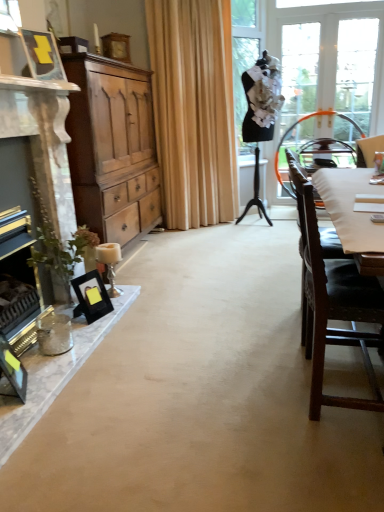
The image size is (384, 512). Identify the location of matte black picture frame at lower left, the first picture frame viewed from the front. (13, 369).

The height and width of the screenshot is (512, 384). Describe the element at coordinates (112, 147) in the screenshot. I see `matte brown cabinet at left` at that location.

Describe the element at coordinates (116, 47) in the screenshot. This screenshot has height=512, width=384. I see `wooden clock at upper center, acting as the fourth picture frame starting from the bottom` at that location.

What do you see at coordinates (350, 207) in the screenshot?
I see `white cloth-covered table at right` at bounding box center [350, 207].

Find the location of `black matte picture frame at lower left, which appears as the third picture frame when viewed from the front`. black matte picture frame at lower left, which appears as the third picture frame when viewed from the front is located at coordinates (88, 298).

I want to click on matte black picture frame at lower left, the first picture frame viewed from the front, so click(13, 369).

Can you confirm if metallic silver fireplace at left is wider than clear glass window at upper right?

Yes, metallic silver fireplace at left is wider than clear glass window at upper right.

Is metallic silver fireplace at left far from clear glass window at upper right?

Yes, metallic silver fireplace at left and clear glass window at upper right are quite far apart.

Who is taller, metallic silver fireplace at left or clear glass window at upper right?

Standing taller between the two is clear glass window at upper right.

From a real-world perspective, is metallic silver fireplace at left over clear glass window at upper right?

Actually, metallic silver fireplace at left is physically below clear glass window at upper right in the real world.

Is matte black picture frame at lower left, positioned as the fourth picture frame in top-to-bottom order, taller or shorter than dark brown wood chair at right, the second chair when ordered from right to left?

In the image, matte black picture frame at lower left, positioned as the fourth picture frame in top-to-bottom order, appears to be shorter than dark brown wood chair at right, the second chair when ordered from right to left.

Is the position of matte black picture frame at lower left, the 1th picture frame ordered from the bottom, more distant than that of dark brown wood chair at right, arranged as the 2th chair when viewed from the top?

Yes, matte black picture frame at lower left, the 1th picture frame ordered from the bottom, is further from the viewer.

Image resolution: width=384 pixels, height=512 pixels. I want to click on chair that is the 1st object located above the matte black picture frame at lower left, the 1th picture frame ordered from the bottom (from the image's perspective), so click(x=332, y=298).

Is matte black picture frame at lower left, positioned as the fourth picture frame in top-to-bottom order, aimed at dark brown wood chair at right, the 1th chair when ordered from front to back?

Yes.

Find the location of a particular element. This screenshot has height=512, width=384. chair that is under the white cloth-covered table at right (from a real-world perspective) is located at coordinates (332, 298).

Which is behind, point (369, 319) or point (376, 230)?

The point (369, 319) is behind.

Looking at this image, from a real-world perspective, which object stands above the other?

white cloth-covered table at right, from a real-world perspective.

Is dark brown wood chair at right, marked as the 1th chair in a left-to-right arrangement, wider than white cloth-covered table at right?

No.

Is black matte picture frame at lower left, marked as the 3th picture frame in a top-to-bottom arrangement, positioned with its back to matte black picture frame at upper left, the second picture frame positioned from the top?

No.

The image size is (384, 512). I want to click on the 3rd picture frame to the left when counting from the black matte picture frame at lower left, which appears as the third picture frame when viewed from the front, so click(x=42, y=55).

Does black matte picture frame at lower left, which appears as the third picture frame when viewed from the front, have a larger size compared to matte black picture frame at upper left, which appears as the second picture frame when viewed from the front?

Yes.

Considering the relative sizes of black matte picture frame at lower left, marked as the 3th picture frame in a top-to-bottom arrangement, and matte black picture frame at upper left, arranged as the 3th picture frame when ordered from the bottom, in the image provided, is black matte picture frame at lower left, marked as the 3th picture frame in a top-to-bottom arrangement, shorter than matte black picture frame at upper left, arranged as the 3th picture frame when ordered from the bottom,?

Yes, black matte picture frame at lower left, marked as the 3th picture frame in a top-to-bottom arrangement, is shorter than matte black picture frame at upper left, arranged as the 3th picture frame when ordered from the bottom.

In the image, is metallic silver fireplace at left positioned in front of or behind matte black picture frame at lower left, the 1th picture frame ordered from the bottom?

metallic silver fireplace at left is positioned farther from the viewer than matte black picture frame at lower left, the 1th picture frame ordered from the bottom.

Which is more distant, (23, 334) or (18, 359)?

The point (23, 334) is farther.

Image resolution: width=384 pixels, height=512 pixels. What are the coordinates of `picture frame in front of the metallic silver fireplace at left` in the screenshot? It's located at (13, 369).

Considering the sizes of metallic silver fireplace at left and matte black picture frame at lower left, which ranks as the 4th picture frame in back-to-front order, in the image, is metallic silver fireplace at left taller or shorter than matte black picture frame at lower left, which ranks as the 4th picture frame in back-to-front order,?

metallic silver fireplace at left is taller than matte black picture frame at lower left, which ranks as the 4th picture frame in back-to-front order.

From the image's perspective, is dark brown wood chair at right, which appears as the 1th chair when ordered from the bottom, under wooden clock at upper center, which is the 1th picture frame from back to front?

Yes, from the image's perspective, dark brown wood chair at right, which appears as the 1th chair when ordered from the bottom, is below wooden clock at upper center, which is the 1th picture frame from back to front.

Between dark brown wood chair at right, which appears as the 1th chair when ordered from the bottom, and wooden clock at upper center, acting as the fourth picture frame starting from the bottom, which one has smaller size?

Smaller between the two is wooden clock at upper center, acting as the fourth picture frame starting from the bottom.

Where is `the 2nd picture frame located above the dark brown wood chair at right, arranged as the 2th chair when viewed from the top (from a real-world perspective)`? Image resolution: width=384 pixels, height=512 pixels. the 2nd picture frame located above the dark brown wood chair at right, arranged as the 2th chair when viewed from the top (from a real-world perspective) is located at coordinates (116, 47).

Does dark brown wood chair at right, arranged as the 2th chair when viewed from the top, turn towards wooden clock at upper center, which is the 1th picture frame from back to front?

No, dark brown wood chair at right, arranged as the 2th chair when viewed from the top, is not oriented towards wooden clock at upper center, which is the 1th picture frame from back to front.

Would you consider beige fabric curtain at center to be distant from black matte picture frame at lower left, which appears as the third picture frame when viewed from the front?

beige fabric curtain at center is positioned a significant distance from black matte picture frame at lower left, which appears as the third picture frame when viewed from the front.

From a real-world perspective, which object rests below the other?

black matte picture frame at lower left, marked as the 2th picture frame in a bottom-to-top arrangement, is physically lower.

From the picture: Which of these two, beige fabric curtain at center or black matte picture frame at lower left, marked as the 2th picture frame in a bottom-to-top arrangement, stands taller?

beige fabric curtain at center is taller.

Locate an element on the screen. This screenshot has width=384, height=512. fireplace that appears below the clear glass window at upper right (from a real-world perspective) is located at coordinates (20, 279).

Locate an element on the screen. This screenshot has height=512, width=384. the 1st chair to the right when counting from the matte black picture frame at lower left, positioned as the fourth picture frame in top-to-bottom order is located at coordinates (332, 298).

Considering their positions, is beige fabric curtain at center positioned closer to dark brown wood chair at right, marked as the 1th chair in a left-to-right arrangement, than white cloth-covered table at right?

Among the two, white cloth-covered table at right is located nearer to dark brown wood chair at right, marked as the 1th chair in a left-to-right arrangement.

Which object lies nearer to the anchor point matte black picture frame at lower left, the first picture frame viewed from the front, matte brown cabinet at left or dark brown wood chair at right, the 1th chair when ordered from front to back?

The object closer to matte black picture frame at lower left, the first picture frame viewed from the front, is dark brown wood chair at right, the 1th chair when ordered from front to back.

From the image, which object appears to be nearer to beige fabric curtain at center, wooden chair at right, acting as the second chair starting from the front, or matte brown cabinet at left?

matte brown cabinet at left is closer to beige fabric curtain at center.

Which object lies further to the anchor point wooden clock at upper center, acting as the fourth picture frame starting from the bottom, white cloth-covered table at right or clear glass window at upper right?

Based on the image, white cloth-covered table at right appears to be further to wooden clock at upper center, acting as the fourth picture frame starting from the bottom.

Which object lies further to the anchor point white cloth-covered table at right, clear glass window at upper right or beige fabric curtain at center?

Among the two, clear glass window at upper right is located further to white cloth-covered table at right.

Which object lies further to the anchor point matte brown cabinet at left, black matte picture frame at lower left, marked as the 3th picture frame in a top-to-bottom arrangement, or matte black picture frame at lower left, the first picture frame viewed from the front?

matte black picture frame at lower left, the first picture frame viewed from the front, lies further to matte brown cabinet at left than the other object.

Which object lies further to the anchor point beige fabric curtain at center, clear glass window at upper right or matte black picture frame at lower left, which ranks as the 4th picture frame in back-to-front order?

matte black picture frame at lower left, which ranks as the 4th picture frame in back-to-front order, is positioned further to the anchor beige fabric curtain at center.

Based on the photo, based on their spatial positions, is matte black picture frame at upper left, marked as the third picture frame in a back-to-front arrangement, or clear glass window at upper right closer to metallic silver fireplace at left?

The object closer to metallic silver fireplace at left is matte black picture frame at upper left, marked as the third picture frame in a back-to-front arrangement.

What are the coordinates of `cabinetry between matte black picture frame at upper left, arranged as the 3th picture frame when ordered from the bottom, and metallic silver fireplace at left vertically` in the screenshot? It's located at (112, 147).

Image resolution: width=384 pixels, height=512 pixels. I want to click on cabinetry between matte black picture frame at upper left, which appears as the second picture frame when viewed from the front, and beige fabric curtain at center, along the z-axis, so click(112, 147).

The width and height of the screenshot is (384, 512). I want to click on curtain between wooden clock at upper center, acting as the fourth picture frame starting from the bottom, and wooden chair at right, acting as the second chair starting from the front, so click(x=192, y=112).

This screenshot has height=512, width=384. Identify the location of curtain located between matte black picture frame at upper left, which appears as the second picture frame when viewed from the front, and wooden chair at right, the 1th chair viewed from the right, in the left-right direction. (192, 112).